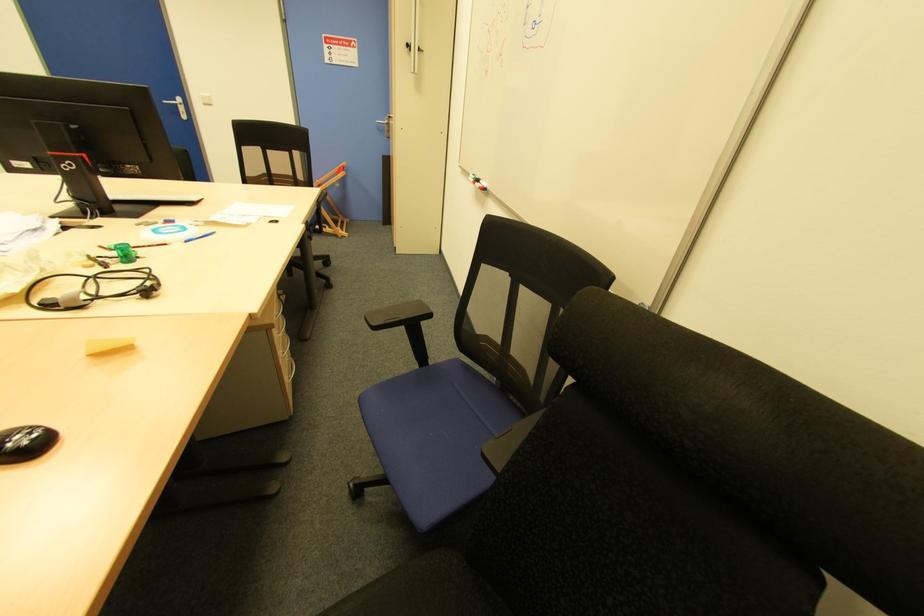
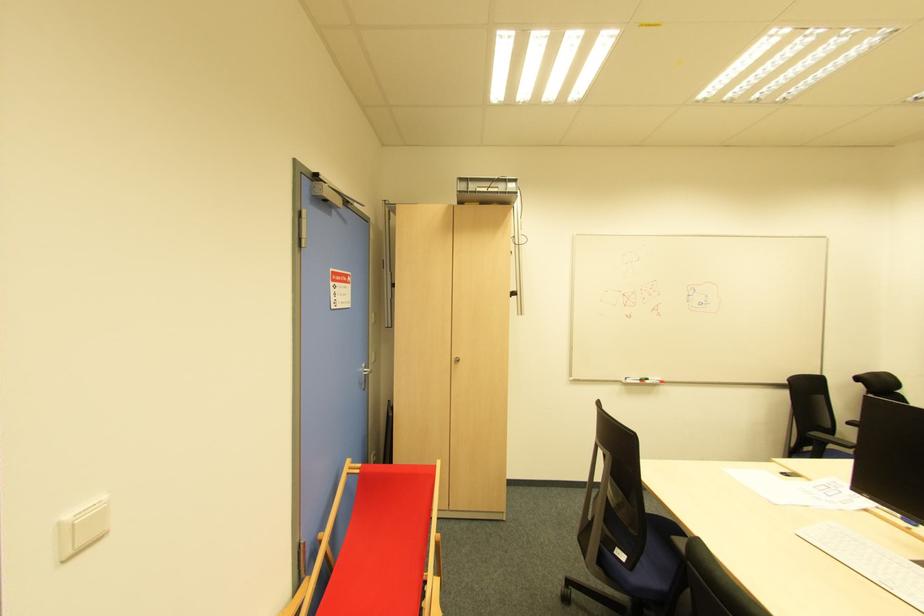
In the second image, find the point that corresponds to (477,185) in the first image.

(647, 383)